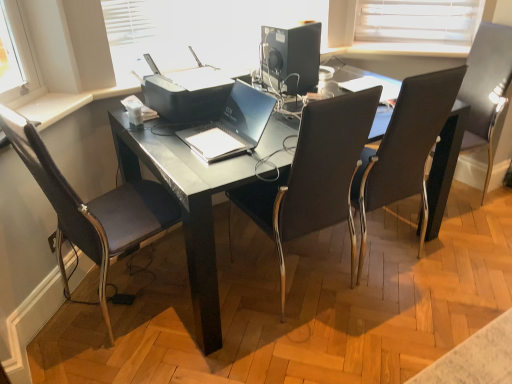
This screenshot has height=384, width=512. What are the coordinates of `vacant space to the right of black leather chair at center, which is the third chair in right-to-left order` in the screenshot? It's located at (394, 295).